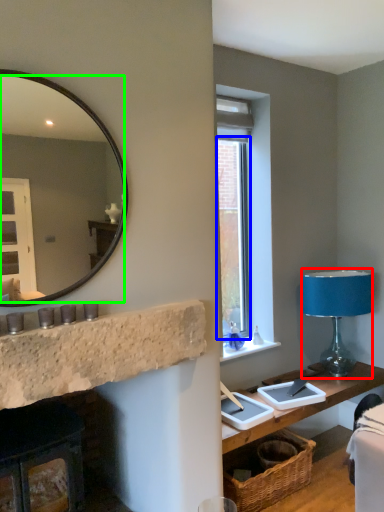
Question: Which object is positioned farthest from table lamp (highlighted by a red box)? Select from window (highlighted by a blue box) and mirror (highlighted by a green box).

Choices:
 (A) window
 (B) mirror

Answer: (B)